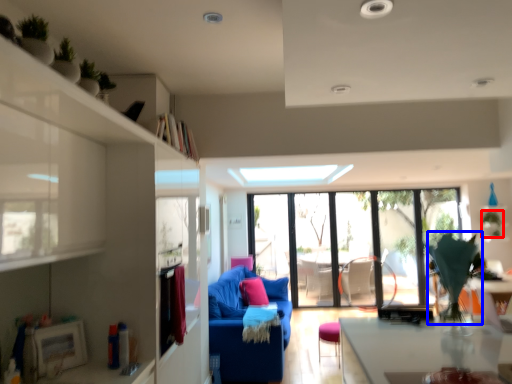
Question: Which object is further to the camera taking this photo, plant (highlighted by a red box) or plant (highlighted by a blue box)?

Choices:
 (A) plant
 (B) plant

Answer: (A)